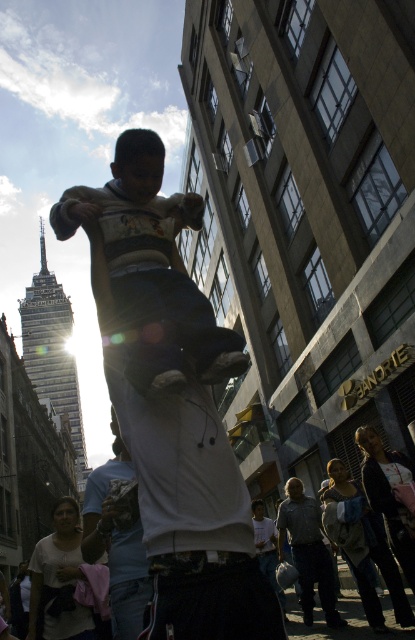
You are a photographer trying to capture the scene. You notice two white items in the frame. The first is the white cotton shirt at center and the second is the white fabric at lower left. Which of these two items appears taller in the image?

The white cotton shirt at center appears taller than the white fabric at lower left in the image.

In the scene shown: You are a photographer trying to capture the best shot of the scene. You notice two points in the image at coordinates point (85, 541) and point (83, 605). Which point should you focus on to ensure it appears larger in your photo?

Point (85, 541) should be focused on because it is closer to the camera, making it appear larger in the photo compared to point (83, 605) which is farther away.